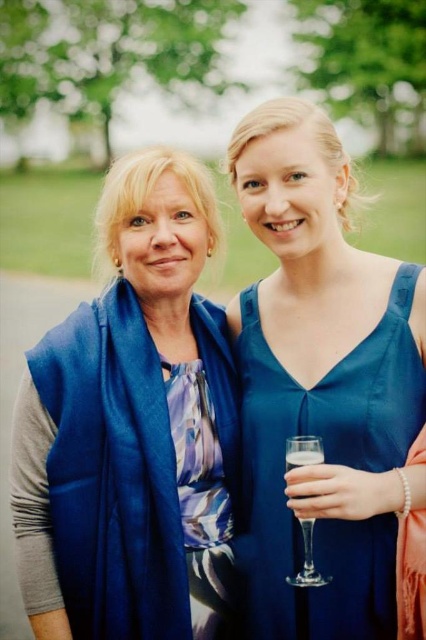
You are a bartender at a party and need to place a clear glass wine glass at right and a clear glass champagne flute at center on a shelf. The shelf has a width of 1.5 inches. Can both glasses fit side by side on the shelf without overlapping?

The clear glass wine glass at right is 1.68 inches away from the clear glass champagne flute at center, so the total width required would be the sum of their individual widths plus the 1.68 inches between them. However, since the shelf is only 1.5 inches wide, both glasses cannot fit side by side without overlapping.

You are at a party and want to grab a drink. You see a clear glass wine glass at right and a clear glass champagne flute at center. Which one is more to the right?

The clear glass wine glass at right is positioned on the right side of the clear glass champagne flute at center, so it is more to the right.